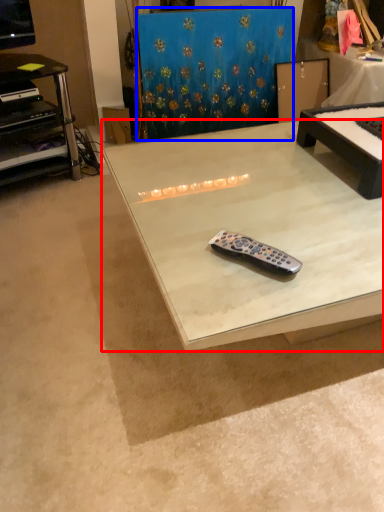
Question: Which of the following is the farthest to the observer, table (highlighted by a red box) or curtain (highlighted by a blue box)?

Choices:
 (A) table
 (B) curtain

Answer: (B)